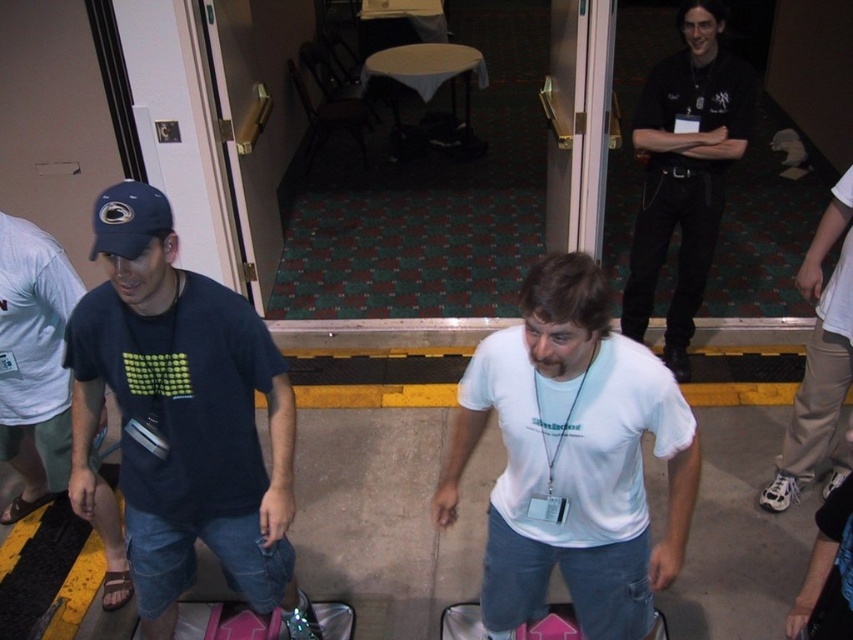
You are standing in the conference room and notice two points marked in the image. Which point is closer to you, point (741, 74) or point (445, 637)?

Point (741, 74) is closer to you because it is further to the viewer than point (445, 637).